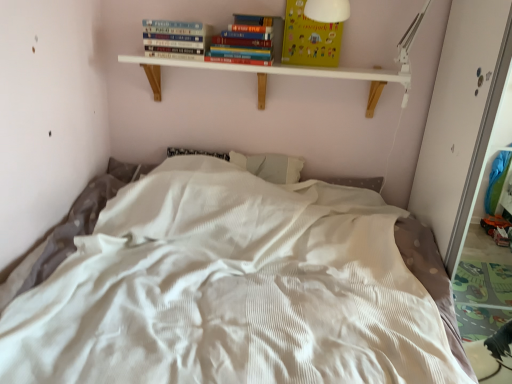
Question: From the image's perspective, relative to hardcover book at upper center, is white wood shelf at upper center above or below?

Choices:
 (A) below
 (B) above

Answer: (A)

Question: Is white wood shelf at upper center inside the boundaries of hardcover book at upper center, or outside?

Choices:
 (A) outside
 (B) inside

Answer: (A)

Question: Estimate the real-world distances between objects in this image. Which object is farther from the hardcover book at upper center?

Choices:
 (A) yellow paper at upper center
 (B) white textured bed at center
 (C) white wood shelf at upper center

Answer: (B)

Question: Estimate the real-world distances between objects in this image. Which object is closer to the yellow paper at upper center?

Choices:
 (A) white wood shelf at upper center
 (B) hardcover book at upper center
 (C) white textured bed at center

Answer: (A)